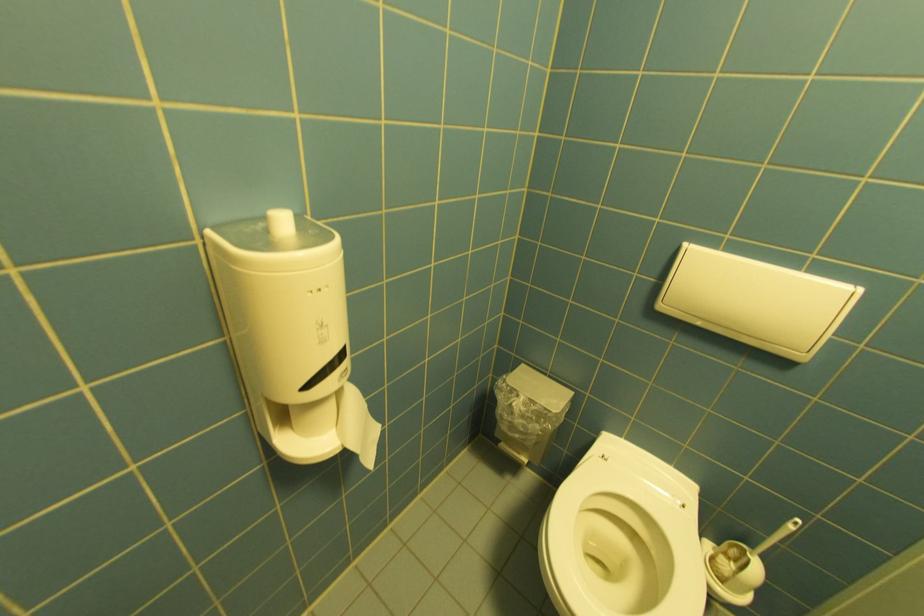
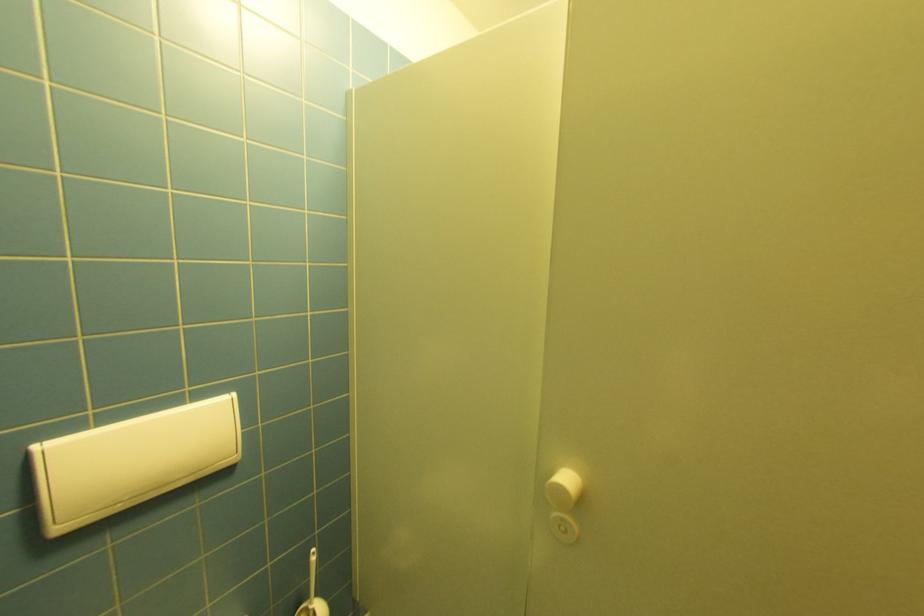
In the second image, find the point that corresponds to the point at 666,308 in the first image.

(66, 530)